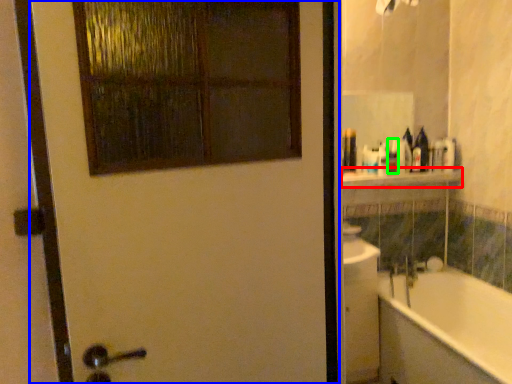
Question: Based on their relative distances, which object is nearer to balustrade (highlighted by a red box)? Choose from door (highlighted by a blue box) and toiletry (highlighted by a green box).

Choices:
 (A) door
 (B) toiletry

Answer: (B)